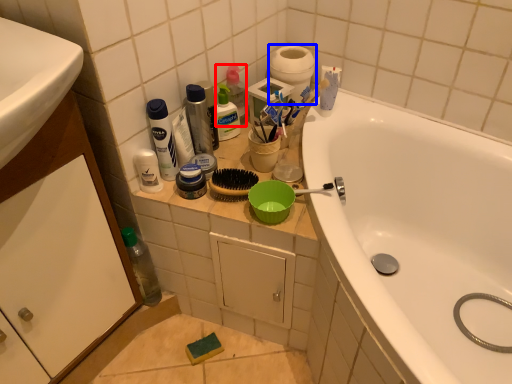
Question: Which point is closer to the camera, cleaning product (highlighted by a red box) or toilet paper (highlighted by a blue box)?

Choices:
 (A) cleaning product
 (B) toilet paper

Answer: (A)